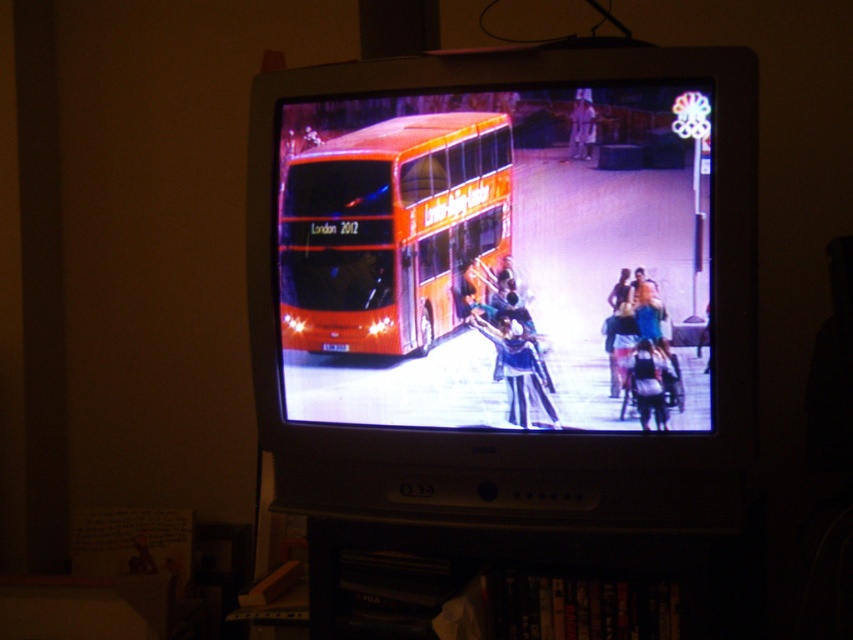
Does orange matte double-decker bus at center have a greater height compared to blue fabric jacket at center?

Yes.

Between orange matte double-decker bus at center and blue fabric jacket at center, which one appears on the right side from the viewer's perspective?

Positioned to the right is blue fabric jacket at center.

The image size is (853, 640). Describe the element at coordinates (392, 230) in the screenshot. I see `orange matte double-decker bus at center` at that location.

The image size is (853, 640). Identify the location of orange matte double-decker bus at center. (392, 230).

Can you confirm if orange matte bus at center is positioned to the left of orange matte double-decker bus at center?

No, orange matte bus at center is not to the left of orange matte double-decker bus at center.

Does point (393, 352) come farther from viewer compared to point (374, 250)?

Yes, point (393, 352) is behind point (374, 250).

Does point (263, 163) come behind point (479, 180)?

Yes.

The image size is (853, 640). In order to click on orange matte bus at center in this screenshot , I will do `click(508, 284)`.

Is orange matte bus at center closer to the viewer compared to blue fabric jacket at center?

Yes, it is in front of blue fabric jacket at center.

Between orange matte bus at center and blue fabric jacket at center, which one has less height?

Standing shorter between the two is blue fabric jacket at center.

The height and width of the screenshot is (640, 853). Describe the element at coordinates (508, 284) in the screenshot. I see `orange matte bus at center` at that location.

At what (x,y) coordinates should I click in order to perform the action: click on orange matte bus at center. Please return your answer as a coordinate pair (x, y). Image resolution: width=853 pixels, height=640 pixels. Looking at the image, I should click on (508, 284).